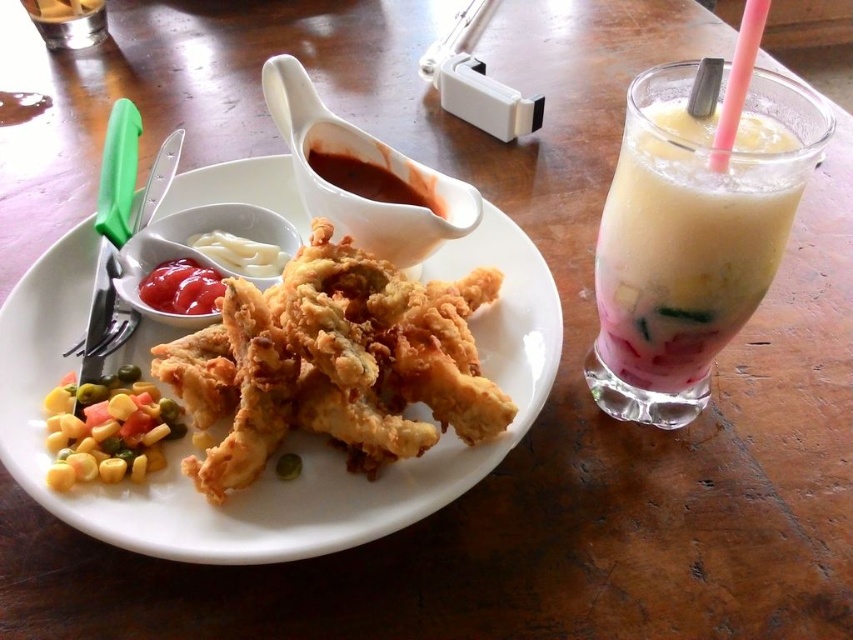
Question: Is golden fried chicken at center wider than white creamy sauce at center?

Choices:
 (A) yes
 (B) no

Answer: (A)

Question: Estimate the real-world distances between objects in this image. Which object is closer to the translucent glass at upper left?

Choices:
 (A) white creamy sauce at center
 (B) milky smooth drink at right
 (C) golden crispy fried chicken at center
 (D) matte red ketchup at upper left

Answer: (A)

Question: Is golden fried chicken at center wider than matte red ketchup at upper left?

Choices:
 (A) yes
 (B) no

Answer: (A)

Question: Can you confirm if golden fried chicken at center is thinner than matte red ketchup at upper left?

Choices:
 (A) yes
 (B) no

Answer: (B)

Question: Among these objects, which one is nearest to the camera?

Choices:
 (A) golden fried chicken at center
 (B) yellow-green corn kernels at center-left

Answer: (A)

Question: Which is farther from the milky smooth drink at right?

Choices:
 (A) yellow-green corn kernels at center-left
 (B) white creamy sauce at center

Answer: (A)